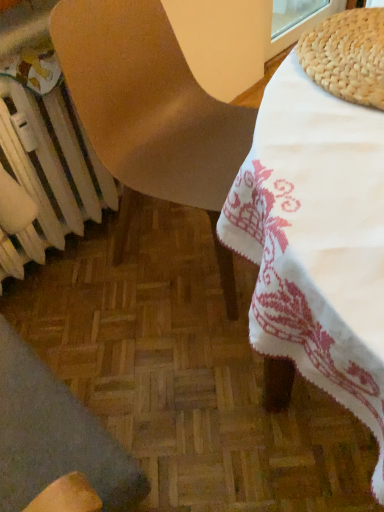
What do you see at coordinates (151, 109) in the screenshot?
I see `matte brown chair at center, which is the 2th chair from bottom to top` at bounding box center [151, 109].

Locate an element on the screen. The width and height of the screenshot is (384, 512). white metallic radiator at lower left is located at coordinates (51, 162).

You are a GUI agent. You are given a task and a screenshot of the screen. Output one action in this format:
    pyautogui.click(x=<x>, y=<y>)
    Task: Click on the matte brown chair at center, which is the 2th chair from bottom to top
    This screenshot has width=384, height=512.
    Given the screenshot: What is the action you would take?
    pyautogui.click(x=151, y=109)

Locate an element on the screen. The height and width of the screenshot is (512, 384). chair above the wooden chair at lower left, which appears as the first chair when ordered from the bottom (from a real-world perspective) is located at coordinates (151, 109).

Between point (15, 440) and point (184, 101), which one is positioned in front?

The point (15, 440) is more forward.

Which is correct: wooden chair at lower left, which appears as the first chair when ordered from the bottom, is inside matte brown chair at center, which is the 2th chair from bottom to top, or outside of it?

wooden chair at lower left, which appears as the first chair when ordered from the bottom, is outside matte brown chair at center, which is the 2th chair from bottom to top.

From a real-world perspective, is wooden chair at lower left, which appears as the first chair when ordered from the bottom, under matte brown chair at center, which is the 2th chair from bottom to top?

Yes, from a real-world perspective, wooden chair at lower left, which appears as the first chair when ordered from the bottom, is under matte brown chair at center, which is the 2th chair from bottom to top.

Visually, is wooden chair at lower left, acting as the second chair starting from the top, positioned to the left or to the right of white metallic radiator at lower left?

wooden chair at lower left, acting as the second chair starting from the top, is to the right of white metallic radiator at lower left.

Is the surface of wooden chair at lower left, acting as the second chair starting from the top, in direct contact with white metallic radiator at lower left?

They are not placed beside each other.

In terms of height, does wooden chair at lower left, acting as the second chair starting from the top, look taller or shorter compared to white metallic radiator at lower left?

wooden chair at lower left, acting as the second chair starting from the top, is taller than white metallic radiator at lower left.

Is white metallic radiator at lower left located within wooden chair at lower left, which appears as the first chair when ordered from the bottom?

No, white metallic radiator at lower left is not inside wooden chair at lower left, which appears as the first chair when ordered from the bottom.

Which of these two, white metallic radiator at lower left or matte brown chair at center, which is the 2th chair from bottom to top, is wider?

Wider between the two is matte brown chair at center, which is the 2th chair from bottom to top.

From a real-world perspective, is white metallic radiator at lower left above or below matte brown chair at center, which is the 2th chair from bottom to top?

Clearly, from a real-world perspective, white metallic radiator at lower left is below matte brown chair at center, which is the 2th chair from bottom to top.

Do you think white metallic radiator at lower left is within matte brown chair at center, marked as the 1th chair in a top-to-bottom arrangement, or outside of it?

white metallic radiator at lower left lies outside matte brown chair at center, marked as the 1th chair in a top-to-bottom arrangement.

From the image's perspective, is white metallic radiator at lower left above or below wooden chair at lower left, acting as the second chair starting from the top?

white metallic radiator at lower left is above wooden chair at lower left, acting as the second chair starting from the top.

Can you see white metallic radiator at lower left touching wooden chair at lower left, which appears as the first chair when ordered from the bottom?

No, white metallic radiator at lower left is not making contact with wooden chair at lower left, which appears as the first chair when ordered from the bottom.

Can you confirm if white metallic radiator at lower left is wider than wooden chair at lower left, acting as the second chair starting from the top?

Incorrect, the width of white metallic radiator at lower left does not surpass that of wooden chair at lower left, acting as the second chair starting from the top.

Is white metallic radiator at lower left turned away from wooden chair at lower left, acting as the second chair starting from the top?

No, white metallic radiator at lower left is not facing away from wooden chair at lower left, acting as the second chair starting from the top.

Where is `the 2nd chair to the right when counting from the white metallic radiator at lower left`? the 2nd chair to the right when counting from the white metallic radiator at lower left is located at coordinates (151, 109).

From a real-world perspective, which object stands above the other?

matte brown chair at center, marked as the 1th chair in a top-to-bottom arrangement, from a real-world perspective.

Is matte brown chair at center, marked as the 1th chair in a top-to-bottom arrangement, positioned in front of white metallic radiator at lower left?

Yes, the depth of matte brown chair at center, marked as the 1th chair in a top-to-bottom arrangement, is less than that of white metallic radiator at lower left.

Is matte brown chair at center, which is the 2th chair from bottom to top, facing towards wooden chair at lower left, which appears as the first chair when ordered from the bottom?

No, matte brown chair at center, which is the 2th chair from bottom to top, is not oriented towards wooden chair at lower left, which appears as the first chair when ordered from the bottom.

What's the angular difference between matte brown chair at center, marked as the 1th chair in a top-to-bottom arrangement, and wooden chair at lower left, which appears as the first chair when ordered from the bottom,'s facing directions?

The angle between the facing direction of matte brown chair at center, marked as the 1th chair in a top-to-bottom arrangement, and the facing direction of wooden chair at lower left, which appears as the first chair when ordered from the bottom, is 84.9 degrees.

Can you confirm if matte brown chair at center, marked as the 1th chair in a top-to-bottom arrangement, is wider than wooden chair at lower left, which appears as the first chair when ordered from the bottom?

Yes, matte brown chair at center, marked as the 1th chair in a top-to-bottom arrangement, is wider than wooden chair at lower left, which appears as the first chair when ordered from the bottom.

Locate an element on the screen. The width and height of the screenshot is (384, 512). chair in front of the matte brown chair at center, which is the 2th chair from bottom to top is located at coordinates (54, 436).

You are a GUI agent. You are given a task and a screenshot of the screen. Output one action in this format:
    pyautogui.click(x=<x>, y=<y>)
    Task: Click on the radiator behind the wooden chair at lower left, acting as the second chair starting from the top
    This screenshot has width=384, height=512.
    Given the screenshot: What is the action you would take?
    pyautogui.click(x=51, y=162)

From the image, which object appears to be nearer to wooden chair at lower left, acting as the second chair starting from the top, white metallic radiator at lower left or matte brown chair at center, which is the 2th chair from bottom to top?

→ Among the two, white metallic radiator at lower left is located nearer to wooden chair at lower left, acting as the second chair starting from the top.

Consider the image. From the image, which object appears to be farther from white metallic radiator at lower left, wooden chair at lower left, which appears as the first chair when ordered from the bottom, or matte brown chair at center, marked as the 1th chair in a top-to-bottom arrangement?

wooden chair at lower left, which appears as the first chair when ordered from the bottom, is further to white metallic radiator at lower left.

Based on their spatial positions, is white metallic radiator at lower left or wooden chair at lower left, acting as the second chair starting from the top, further from matte brown chair at center, marked as the 1th chair in a top-to-bottom arrangement?

wooden chair at lower left, acting as the second chair starting from the top, is positioned further to the anchor matte brown chair at center, marked as the 1th chair in a top-to-bottom arrangement.

From the image, which object appears to be nearer to wooden chair at lower left, which appears as the first chair when ordered from the bottom, matte brown chair at center, which is the 2th chair from bottom to top, or white metallic radiator at lower left?

white metallic radiator at lower left lies closer to wooden chair at lower left, which appears as the first chair when ordered from the bottom, than the other object.

When comparing their distances from matte brown chair at center, which is the 2th chair from bottom to top, does wooden chair at lower left, acting as the second chair starting from the top, or white metallic radiator at lower left seem closer?

white metallic radiator at lower left.

Looking at the image, which one is located further to white metallic radiator at lower left, matte brown chair at center, marked as the 1th chair in a top-to-bottom arrangement, or wooden chair at lower left, which appears as the first chair when ordered from the bottom?

Among the two, wooden chair at lower left, which appears as the first chair when ordered from the bottom, is located further to white metallic radiator at lower left.

Where is `chair between wooden chair at lower left, acting as the second chair starting from the top, and white metallic radiator at lower left, along the z-axis`? chair between wooden chair at lower left, acting as the second chair starting from the top, and white metallic radiator at lower left, along the z-axis is located at coordinates (151, 109).